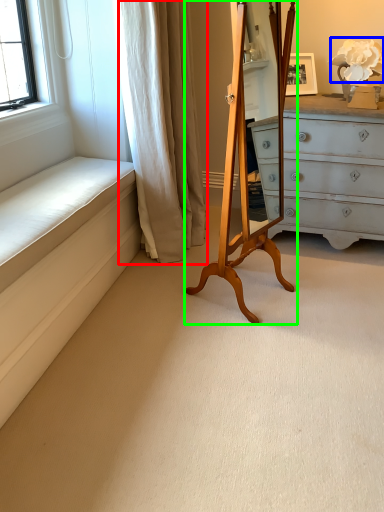
Question: Which is nearer to the curtain (highlighted by a red box)? flower (highlighted by a blue box) or easel (highlighted by a green box).

Choices:
 (A) flower
 (B) easel

Answer: (B)